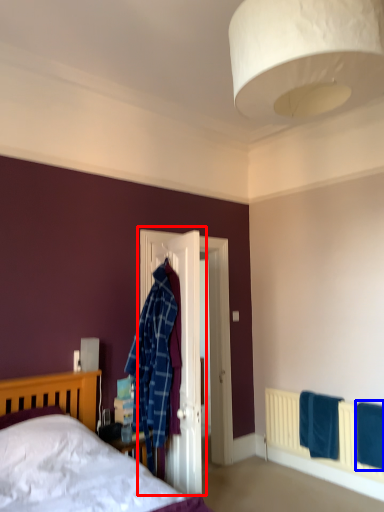
Question: Which point is closer to the camera, door (highlighted by a red box) or bath towel (highlighted by a blue box)?

Choices:
 (A) door
 (B) bath towel

Answer: (B)